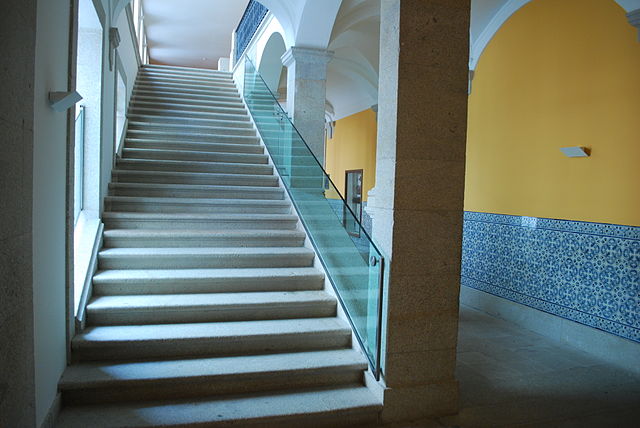
Where is `hallway`? The image size is (640, 428). hallway is located at coordinates (468, 324).